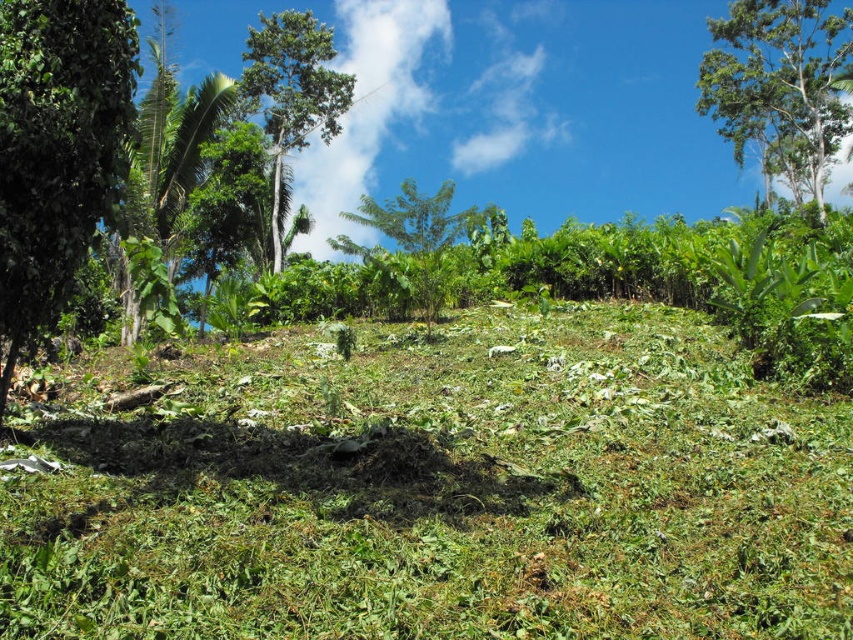
You are standing in a tropical garden and want to take a photo of the green leafy tree at upper right. If your camera can focus on objects up to 20 meters away, will you need to move closer to get a clear shot?

The green leafy tree at upper right is 21.95 meters from camera, which is beyond the camera focus range of 20 meters. You need to move closer to get a clear shot.

You are a bird flying over the lush tropical landscape. You see the green leafy tree at upper right and the green leafy tree at center. Which tree is positioned higher in the sky?

The green leafy tree at upper right is positioned higher in the sky than the green leafy tree at center.